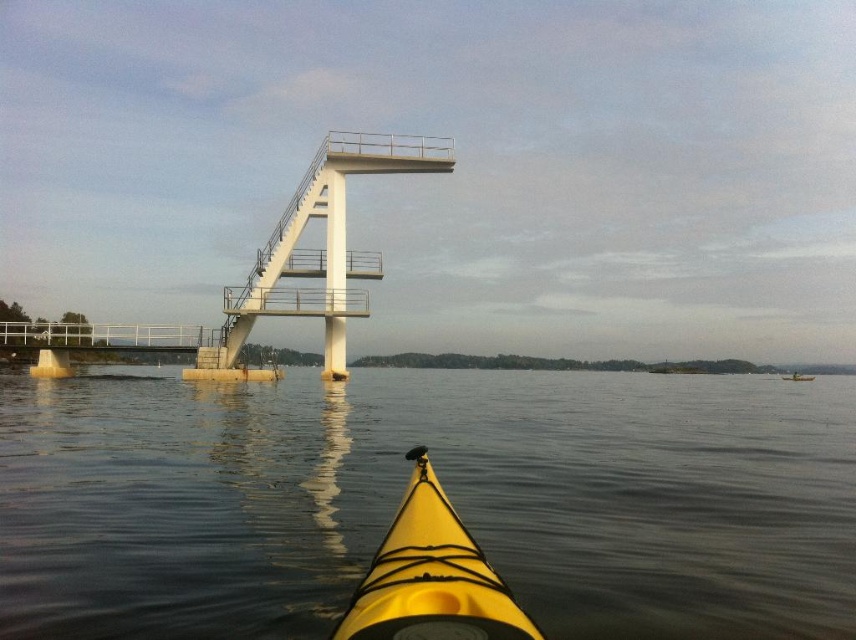
You are planning to row your yellow rubber kayak at center under the white metallic bridge at center. Based on the scene, will the kayak fit through the opening beneath the bridge?

The yellow rubber kayak at center is wider than the white metallic bridge at center, so it will not fit through the opening beneath the bridge.

You are standing on the white diving platform and looking down at the water. You see the yellow rubber kayak at center and the yellow matte kayak at lower center. Which kayak is closer to you?

The yellow rubber kayak at center is positioned under the yellow matte kayak at lower center, so the yellow rubber kayak at center is closer to you.